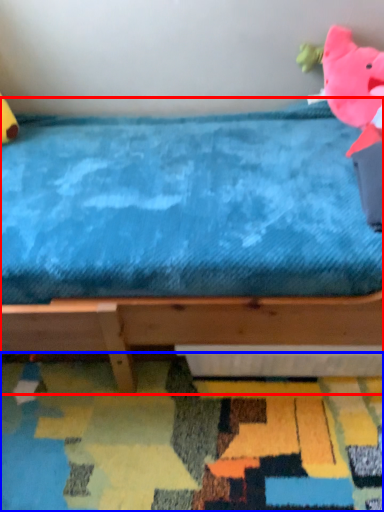
Question: Among these objects, which one is nearest to the camera, bed (highlighted by a red box) or mat (highlighted by a blue box)?

Choices:
 (A) bed
 (B) mat

Answer: (A)